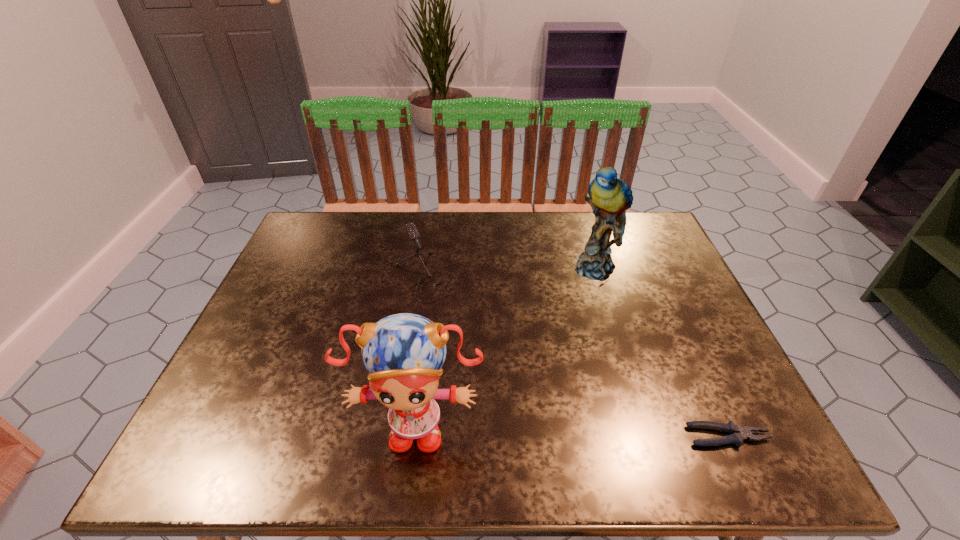
Where is `vacant space in between the pliers and the second shortest object`? vacant space in between the pliers and the second shortest object is located at coordinates (578, 356).

Image resolution: width=960 pixels, height=540 pixels. What are the coordinates of `free space between the rightmost object and the tallest object` in the screenshot? It's located at (663, 352).

The width and height of the screenshot is (960, 540). What are the coordinates of `free space between the tallest object and the second shortest object` in the screenshot? It's located at (514, 272).

What are the coordinates of `free space between the parrot and the pliers` in the screenshot? It's located at (663, 352).

You are a GUI agent. You are given a task and a screenshot of the screen. Output one action in this format:
    pyautogui.click(x=<x>, y=<y>)
    Task: Click on the free space between the pliers and the second shortest object
    
    Given the screenshot: What is the action you would take?
    pyautogui.click(x=578, y=356)

Find the location of a particular element. the third closest object to the microphone is located at coordinates tap(738, 434).

Point out which object is positioned as the nearest to the third object from left to right. Please provide its 2D coordinates. Your answer should be formatted as a tuple, i.e. [(x, y)], where the tuple contains the x and y coordinates of a point satisfying the conditions above.

[(411, 229)]

What are the coordinates of `free point that satisfies the following two spatial constraints: 1. on the front side of the shortest object; 2. at the gripping part of the third object from left to right` in the screenshot? It's located at (651, 436).

Where is `free space that satisfies the following two spatial constraints: 1. on the face of the pliers; 2. at the gripping part of the third shortest object`? Image resolution: width=960 pixels, height=540 pixels. free space that satisfies the following two spatial constraints: 1. on the face of the pliers; 2. at the gripping part of the third shortest object is located at coordinates (414, 436).

This screenshot has height=540, width=960. What are the coordinates of `free space that satisfies the following two spatial constraints: 1. on the front side of the pliers; 2. at the gripping part of the third tallest object` in the screenshot? It's located at (406, 436).